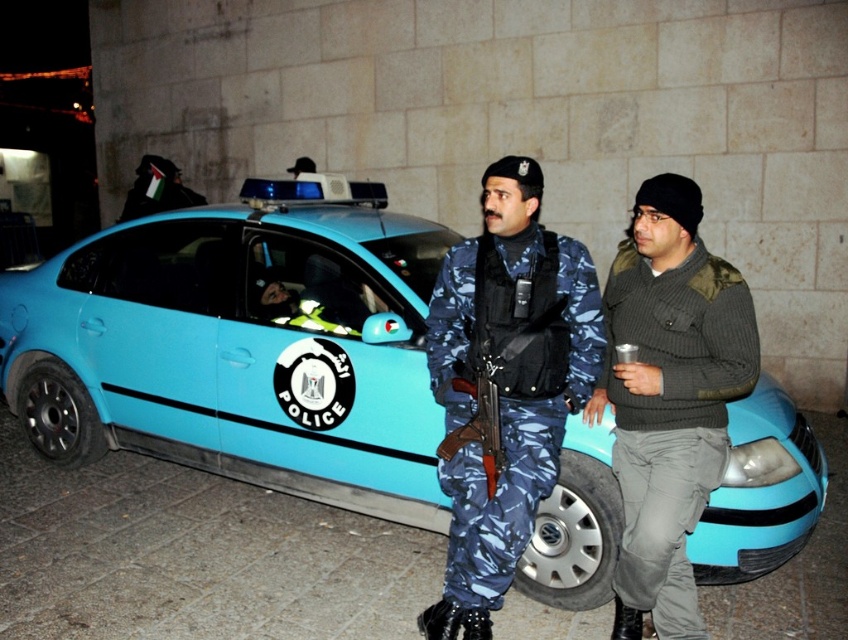
Question: Is light blue plastic car at center bigger than knit sweater at center?

Choices:
 (A) no
 (B) yes

Answer: (B)

Question: Which of these objects is positioned closest to the knit sweater at center?

Choices:
 (A) camouflage uniform at center
 (B) light blue plastic car at center

Answer: (A)

Question: Which is farther from the light blue plastic car at center?

Choices:
 (A) camouflage uniform at center
 (B) knit sweater at center

Answer: (B)

Question: Does light blue plastic car at center appear on the left side of camouflage uniform at center?

Choices:
 (A) yes
 (B) no

Answer: (A)

Question: Does camouflage uniform at center have a lesser width compared to knit sweater at center?

Choices:
 (A) yes
 (B) no

Answer: (B)

Question: Which object is closer to the camera taking this photo?

Choices:
 (A) light blue plastic car at center
 (B) knit sweater at center
 (C) camouflage uniform at center

Answer: (C)